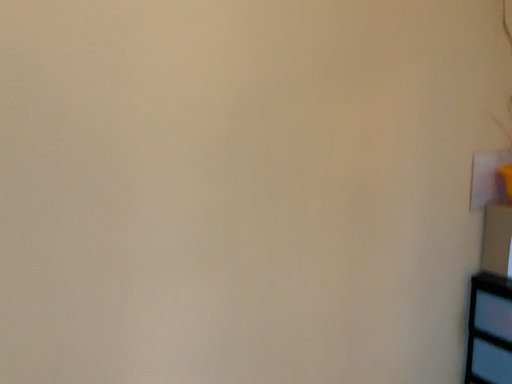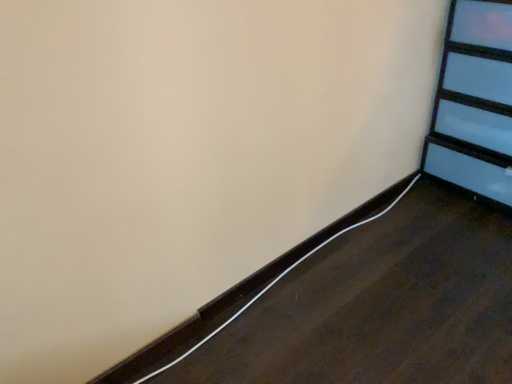
Question: How did the camera likely rotate when shooting the video?

Choices:
 (A) rotated right
 (B) rotated left

Answer: (A)